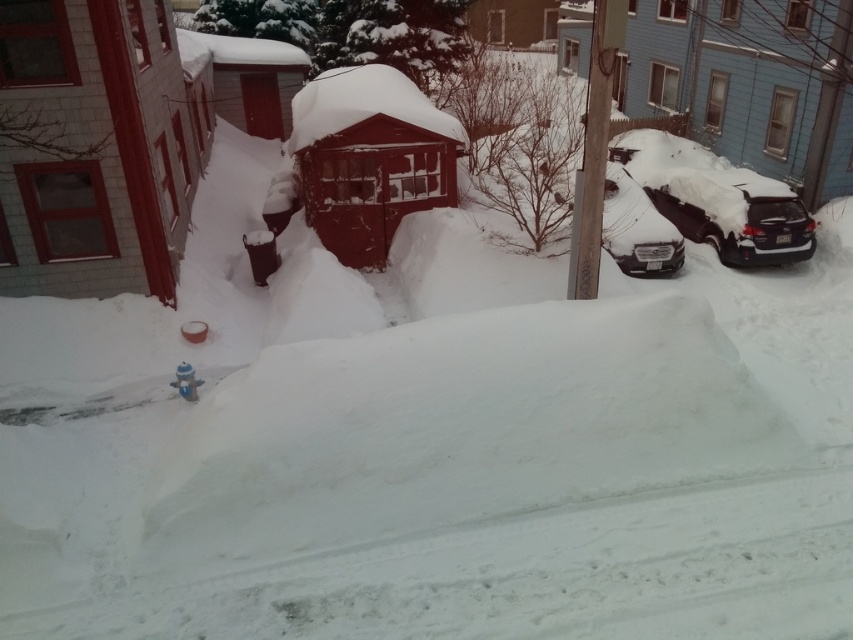
You are standing on the balcony and want to take a photo of the sleek black car at right. Where should you aim your camera to capture it?

You should aim your camera at point (x=737, y=216) to capture the sleek black car at right.